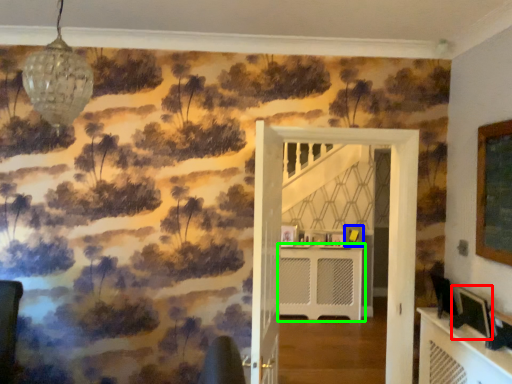
Question: Estimate the real-world distances between objects in this image. Which object is closer to picture frame (highlighted by a red box), picture frame (highlighted by a blue box) or table (highlighted by a green box)?

Choices:
 (A) picture frame
 (B) table

Answer: (A)